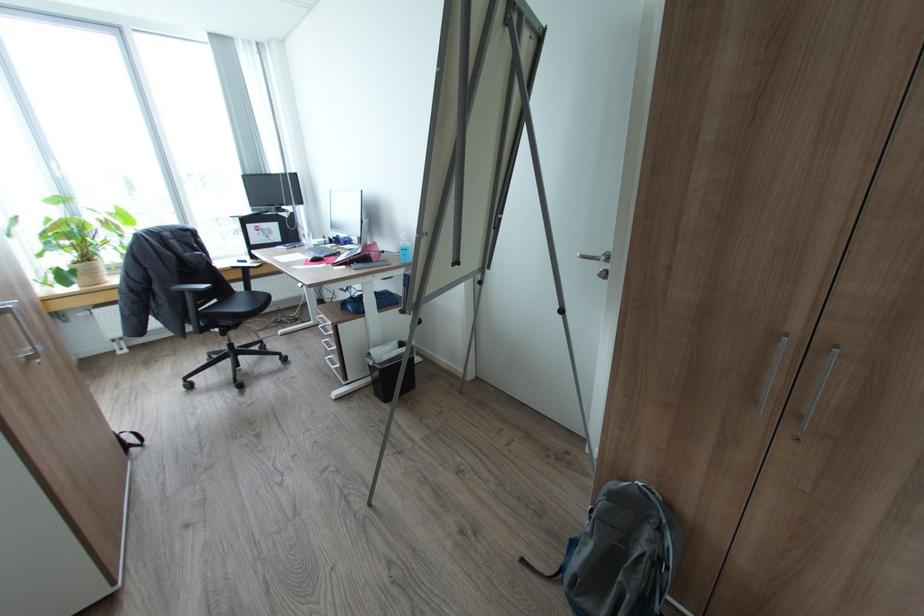
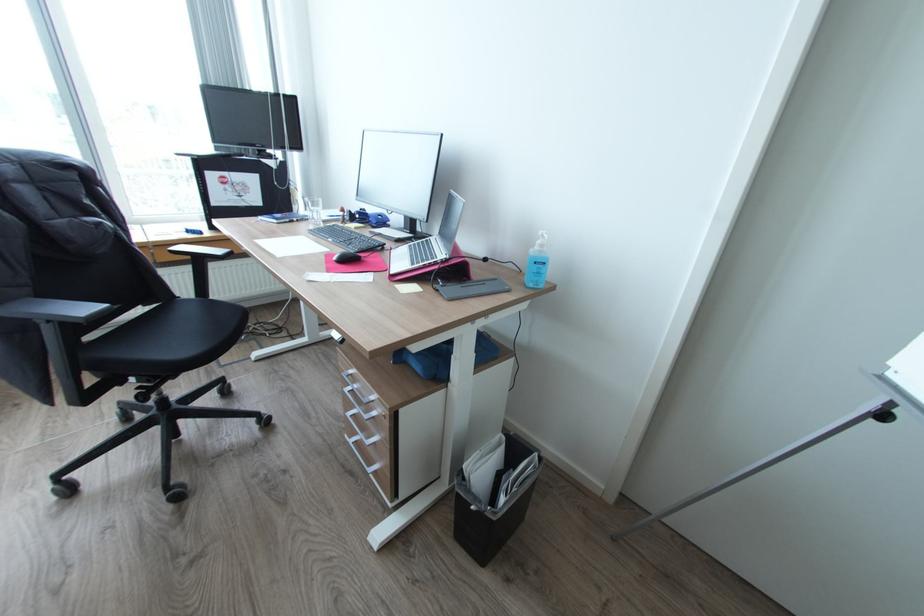
The point at (x=334, y=347) is marked in the first image. Where is the corresponding point in the second image?

(372, 438)